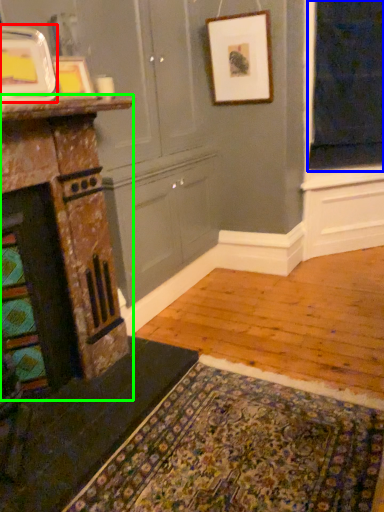
Question: Considering the real-world distances, which object is farthest from picture frame (highlighted by a red box)? window screen (highlighted by a blue box) or fireplace (highlighted by a green box)?

Choices:
 (A) window screen
 (B) fireplace

Answer: (A)